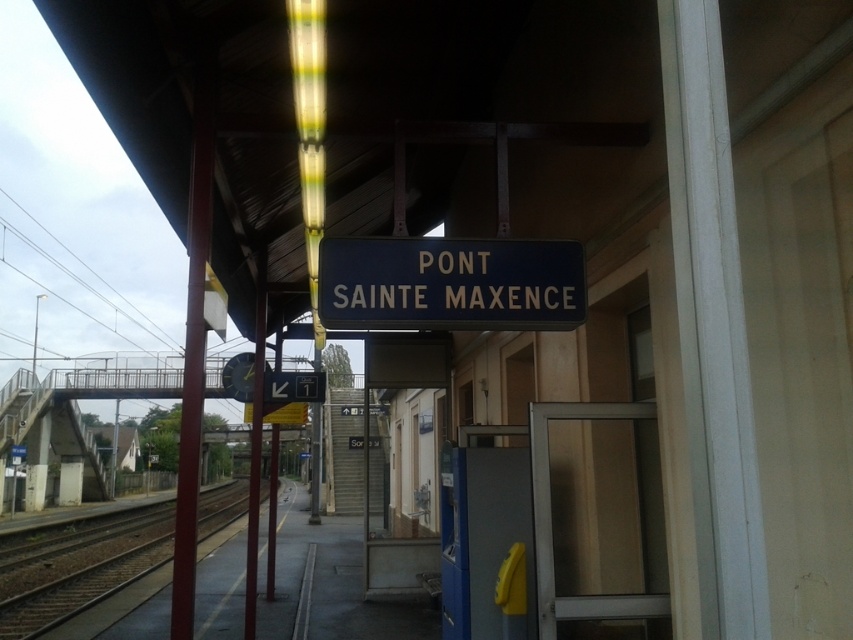
You are a commuter waiting on the platform and want to board the train that will arrive on the brown wooden train track at lower left. Where should you stand relative to the blue metallic sign at center to be closest to the train when it arrives?

The blue metallic sign at center is above the brown wooden train track at lower left, so you should stand directly below the blue metallic sign at center to be closest to the brown wooden train track at lower left when the train arrives.